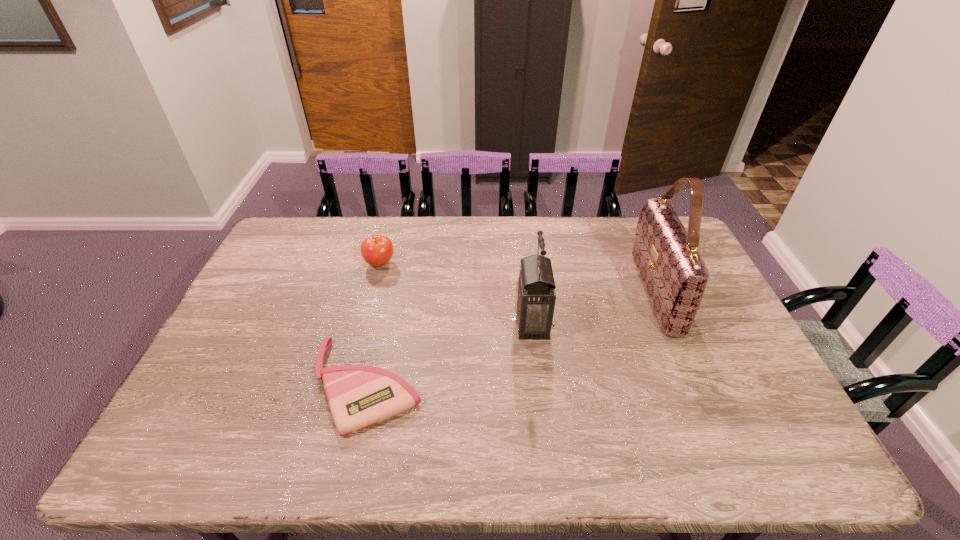
The width and height of the screenshot is (960, 540). In the image, there is a desktop. Find the location of `vacant space at the near edge`. vacant space at the near edge is located at coordinates (612, 448).

In the image, there is a desktop. At what (x,y) coordinates should I click in order to perform the action: click on vacant region at the left edge. Please return your answer as a coordinate pair (x, y). This screenshot has height=540, width=960. Looking at the image, I should click on (228, 341).

This screenshot has height=540, width=960. Identify the location of vacant space at the right edge. tap(700, 328).

The width and height of the screenshot is (960, 540). What are the coordinates of `blank area at the far left corner` in the screenshot? It's located at (278, 242).

Identify the location of vacant space at the near left corner of the desktop. The height and width of the screenshot is (540, 960). (215, 446).

Image resolution: width=960 pixels, height=540 pixels. I want to click on free region at the near right corner, so 781,451.

Identify the location of free area in between the second tallest object and the wristlet. (450, 355).

Where is `free space between the third shortest object and the shortest object`? free space between the third shortest object and the shortest object is located at coordinates (450, 355).

This screenshot has width=960, height=540. Identify the location of free spot between the second tallest object and the third tallest object. (456, 294).

Identify the location of empty space between the apple and the handbag. (517, 278).